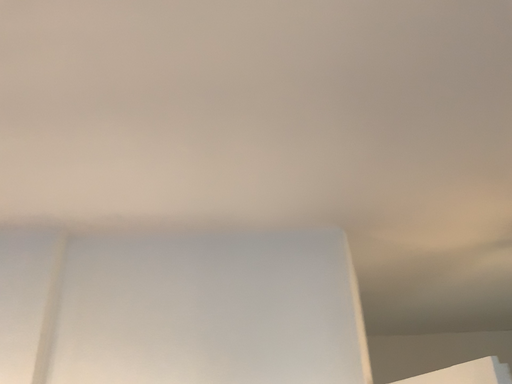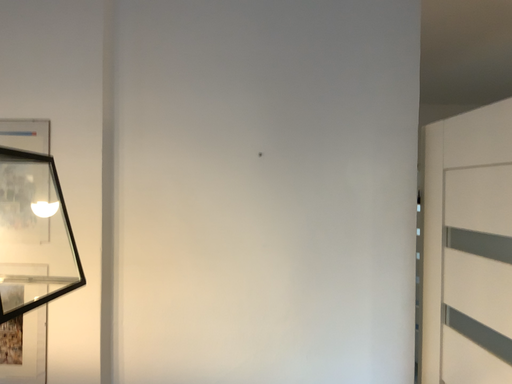
Question: How did the camera likely rotate when shooting the video?

Choices:
 (A) rotated upward
 (B) rotated downward

Answer: (B)